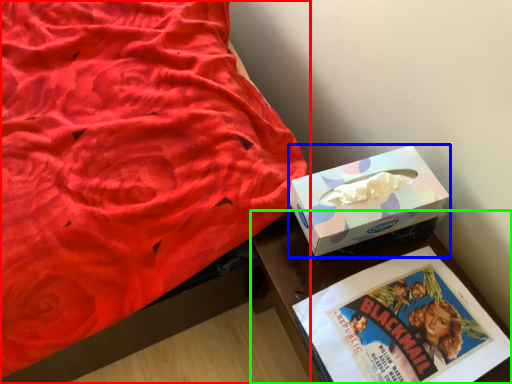
Question: Considering the real-world distances, which object is farthest from bed (highlighted by a red box)? box (highlighted by a blue box) or table (highlighted by a green box)?

Choices:
 (A) box
 (B) table

Answer: (A)